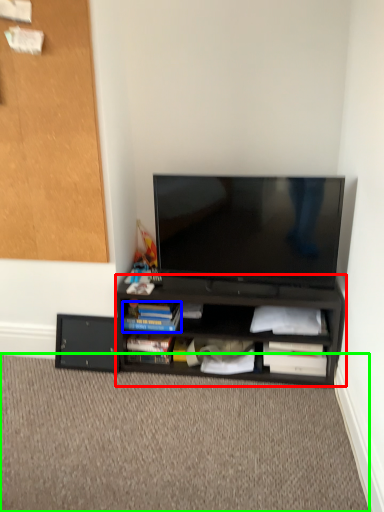
Question: Which is farther away from desk (highlighted by a red box)? paperback book (highlighted by a blue box) or plain (highlighted by a green box)?

Choices:
 (A) paperback book
 (B) plain

Answer: (B)